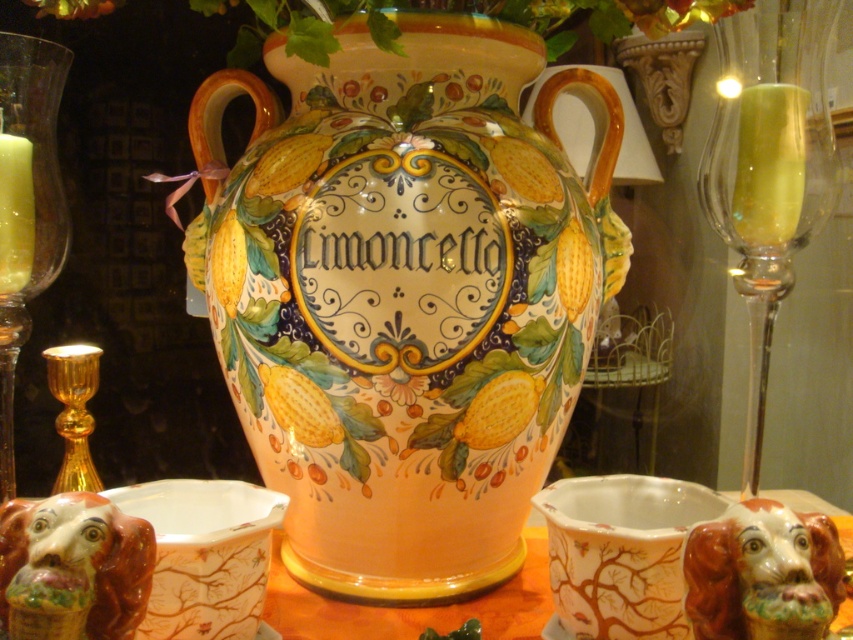
Question: Which of the following is the closest to the observer?

Choices:
 (A) yellow wax candle at left
 (B) gold metallic candle holder at left
 (C) green leafy plant at upper center

Answer: (A)

Question: Considering the relative positions of transparent glass wine glass at upper right and gold metallic candle holder at left in the image provided, where is transparent glass wine glass at upper right located with respect to gold metallic candle holder at left?

Choices:
 (A) left
 (B) right

Answer: (B)

Question: Considering the real-world distances, which object is closest to the transparent glass wine glass at upper right?

Choices:
 (A) matte ceramic vase at center
 (B) yellow wax candle at left

Answer: (A)

Question: From the image, what is the correct spatial relationship of green leafy plant at upper center in relation to yellow wax candle at left?

Choices:
 (A) below
 (B) above

Answer: (B)

Question: Estimate the real-world distances between objects in this image. Which object is farther from the matte ceramic vase at center?

Choices:
 (A) transparent glass wine glass at upper right
 (B) green leafy plant at upper center
 (C) yellow wax candle at left
 (D) gold metallic candle holder at left

Answer: (D)

Question: Is matte ceramic vase at center positioned in front of transparent glass wine glass at upper right?

Choices:
 (A) no
 (B) yes

Answer: (A)